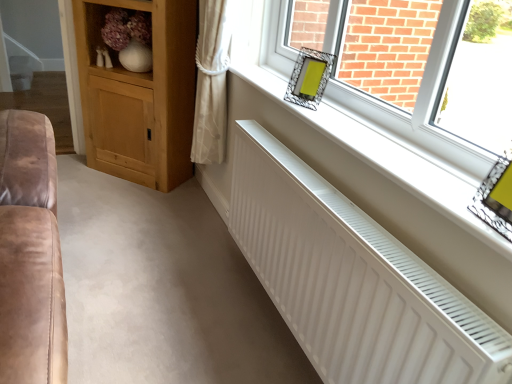
Where is `vacant area on the back side of metallic silver frame at upper right, marked as the first picture frame in a bottom-to-top arrangement`? Image resolution: width=512 pixels, height=384 pixels. vacant area on the back side of metallic silver frame at upper right, marked as the first picture frame in a bottom-to-top arrangement is located at coordinates (452, 187).